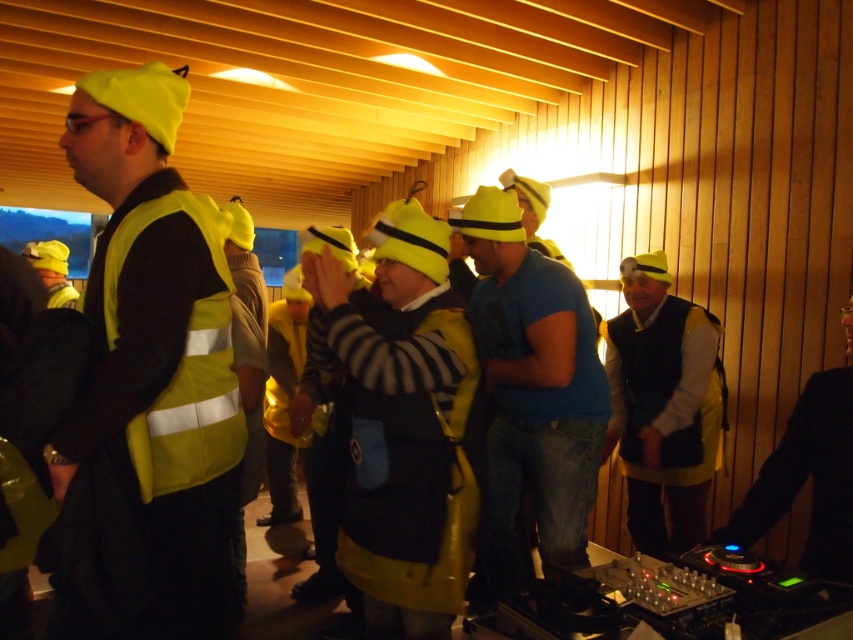
Question: Which object appears closest to the camera in this image?

Choices:
 (A) yellow fabric backpack at center
 (B) yellow reflective vest at center

Answer: (A)

Question: Can you confirm if matte yellow vest at center is thinner than yellow reflective vest at center?

Choices:
 (A) yes
 (B) no

Answer: (A)

Question: Which point is closer to the camera taking this photo?

Choices:
 (A) (114, 538)
 (B) (492, 538)
 (C) (112, 332)

Answer: (A)

Question: Which object is closer to the camera taking this photo?

Choices:
 (A) matte yellow safety vest at left
 (B) yellow fabric backpack at center
 (C) blue cotton t-shirt at center

Answer: (A)

Question: In this image, where is matte yellow safety vest at left located relative to yellow reflective vest at center?

Choices:
 (A) right
 (B) left

Answer: (A)

Question: Does matte yellow safety vest at left have a greater width compared to matte yellow vest at center?

Choices:
 (A) no
 (B) yes

Answer: (A)